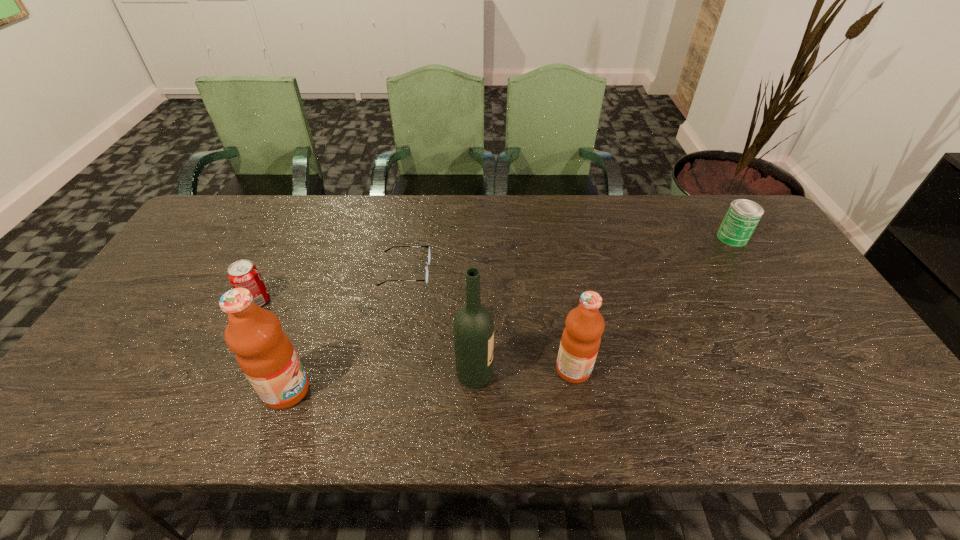
The image size is (960, 540). What are the coordinates of `the taller fruit juice` in the screenshot? It's located at (265, 354).

Locate an element on the screen. the left fruit juice is located at coordinates (265, 354).

Locate an element on the screen. the right fruit juice is located at coordinates (581, 338).

Identify the location of the shorter fruit juice. (581, 338).

Where is `the rightmost object`? The width and height of the screenshot is (960, 540). the rightmost object is located at coordinates 742,216.

You are a GUI agent. You are given a task and a screenshot of the screen. Output one action in this format:
    pyautogui.click(x=<x>, y=<y>)
    Task: Click on the farthest object
    This screenshot has width=960, height=540.
    Given the screenshot: What is the action you would take?
    pyautogui.click(x=742, y=216)

Locate an element on the screen. Image resolution: width=960 pixels, height=540 pixels. soda is located at coordinates (243, 273).

I want to click on the third farthest object, so pos(243,273).

Find the location of `spectacles`. spectacles is located at coordinates (428, 261).

I want to click on the third object from left to right, so (x=428, y=261).